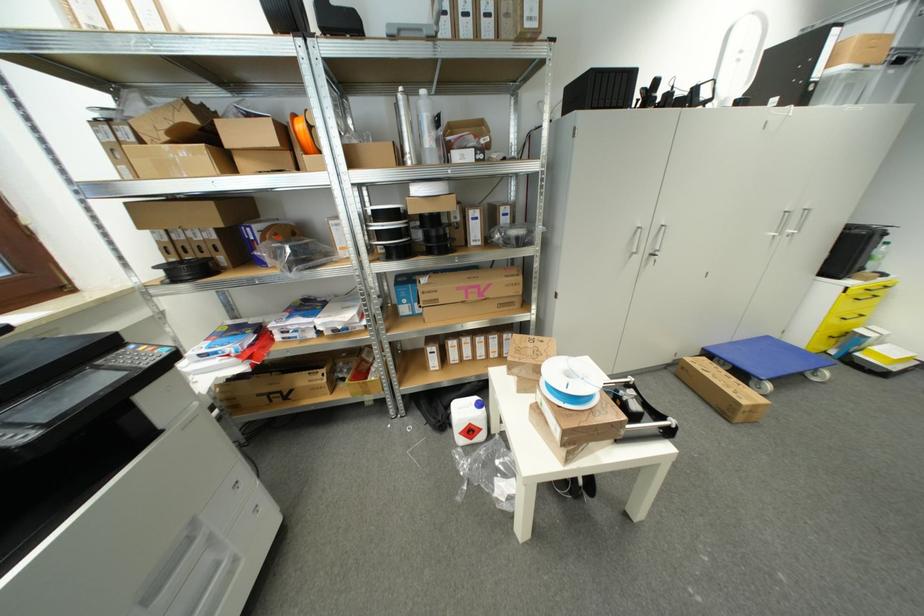
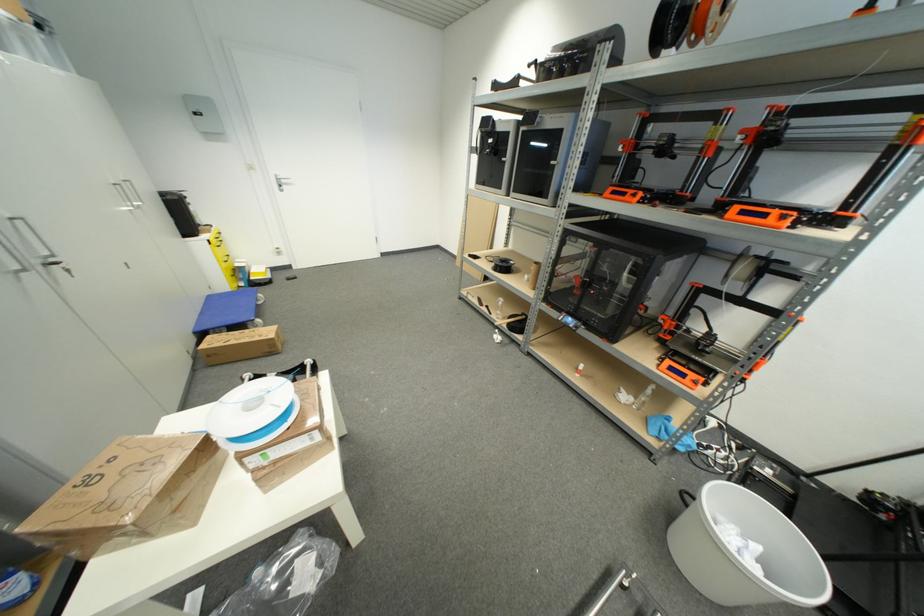
Based on the continuous images, in which direction is the camera rotating?

The camera rotated toward right-down.